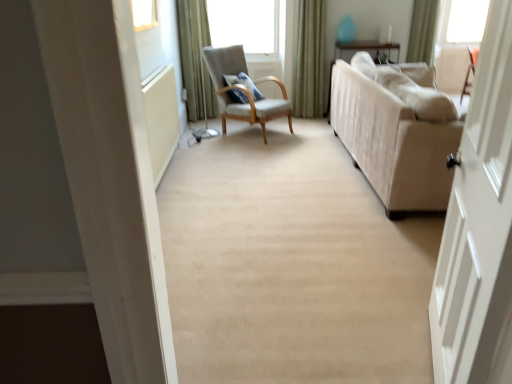
What do you see at coordinates (396, 133) in the screenshot?
I see `beige fabric couch at right` at bounding box center [396, 133].

Describe the element at coordinates (190, 58) in the screenshot. I see `green fabric curtain at upper left, arranged as the third curtain when viewed from the right` at that location.

The height and width of the screenshot is (384, 512). What do you see at coordinates (423, 31) in the screenshot?
I see `green fabric curtain at upper right, the third curtain when ordered from left to right` at bounding box center [423, 31].

Where is `green velvet curtain at upper right, which is the second curtain from left to right`? The image size is (512, 384). green velvet curtain at upper right, which is the second curtain from left to right is located at coordinates (309, 58).

Image resolution: width=512 pixels, height=384 pixels. Find the location of `beige fabric couch at right`. beige fabric couch at right is located at coordinates (396, 133).

Looking at their sizes, would you say green velvet curtain at upper right, which is the second curtain from left to right, is wider or thinner than blue textured pillow at center?

Clearly, green velvet curtain at upper right, which is the second curtain from left to right, has less width compared to blue textured pillow at center.

Are green velvet curtain at upper right, which is the second curtain from left to right, and blue textured pillow at center beside each other?

No, green velvet curtain at upper right, which is the second curtain from left to right, is not making contact with blue textured pillow at center.

Can you tell me how much green velvet curtain at upper right, which is the second curtain from right to left, and blue textured pillow at center differ in facing direction?

51.9 degrees separate the facing orientations of green velvet curtain at upper right, which is the second curtain from right to left, and blue textured pillow at center.

From the image's perspective, is green velvet curtain at upper right, which is the second curtain from left to right, over blue textured pillow at center?

Yes.

Consider the image. Are blue textured pillow at center and beige fabric couch at right located far from each other?

That's right, there is a large distance between blue textured pillow at center and beige fabric couch at right.

Which object is further away from the camera taking this photo, blue textured pillow at center or beige fabric couch at right?

blue textured pillow at center.

From the image's perspective, which one is positioned higher, blue textured pillow at center or beige fabric couch at right?

blue textured pillow at center appears higher in the image.

Is blue textured pillow at center not within beige fabric couch at right?

Yes, blue textured pillow at center is located beyond the bounds of beige fabric couch at right.

Does beige fabric couch at right touch light gray fabric chair at center?

No, beige fabric couch at right is not with light gray fabric chair at center.

Which point is more forward, (430, 153) or (273, 115)?

The point (430, 153) is closer to the camera.

What's the angular difference between beige fabric couch at right and light gray fabric chair at center's facing directions?

42.2 degrees separate the facing orientations of beige fabric couch at right and light gray fabric chair at center.

From a real-world perspective, is beige fabric couch at right physically located above or below light gray fabric chair at center?

From a real-world perspective, beige fabric couch at right is physically below light gray fabric chair at center.

From a real-world perspective, is green fabric curtain at upper right, which is the first curtain in right-to-left order, located higher than beige fabric couch at right?

Indeed, from a real-world perspective, green fabric curtain at upper right, which is the first curtain in right-to-left order, stands above beige fabric couch at right.

Can you tell me how much green fabric curtain at upper right, the third curtain when ordered from left to right, and beige fabric couch at right differ in facing direction?

They differ by 34.3 degrees in their facing directions.

Is green fabric curtain at upper right, the third curtain when ordered from left to right, surrounding beige fabric couch at right?

No, beige fabric couch at right is not surrounded by green fabric curtain at upper right, the third curtain when ordered from left to right.

Locate an element on the screen. Image resolution: width=512 pixels, height=384 pixels. chair lying in front of the green fabric curtain at upper right, which is the first curtain in right-to-left order is located at coordinates (242, 90).

Is the depth of light gray fabric chair at center less than that of green fabric curtain at upper right, the third curtain when ordered from left to right?

Yes, it is.

Based on the photo, can you confirm if light gray fabric chair at center is shorter than green fabric curtain at upper right, the third curtain when ordered from left to right?

In fact, light gray fabric chair at center may be taller than green fabric curtain at upper right, the third curtain when ordered from left to right.

Is light gray fabric chair at center turned away from green fabric curtain at upper right, the third curtain when ordered from left to right?

No, light gray fabric chair at center is not facing the opposite direction of green fabric curtain at upper right, the third curtain when ordered from left to right.

Where is `the 2nd curtain counting from the left side of the beige fabric couch at right`? Image resolution: width=512 pixels, height=384 pixels. the 2nd curtain counting from the left side of the beige fabric couch at right is located at coordinates (190, 58).

Who is bigger, green fabric curtain at upper left, arranged as the third curtain when viewed from the right, or beige fabric couch at right?

beige fabric couch at right.

Looking at this image, from the image's perspective, which one is positioned lower, green fabric curtain at upper left, which is the first curtain from left to right, or beige fabric couch at right?

beige fabric couch at right appears lower in the image.

Which of these two, green fabric curtain at upper left, which is the first curtain from left to right, or beige fabric couch at right, stands taller?

green fabric curtain at upper left, which is the first curtain from left to right, is taller.

Does green fabric curtain at upper left, arranged as the third curtain when viewed from the right, contain green velvet curtain at upper right, which is the second curtain from left to right?

No, green velvet curtain at upper right, which is the second curtain from left to right, is not a part of green fabric curtain at upper left, arranged as the third curtain when viewed from the right.

Is point (207, 116) closer to viewer compared to point (314, 76)?

Yes, it is.

Is green fabric curtain at upper left, which is the first curtain from left to right, to the left of green velvet curtain at upper right, which is the second curtain from right to left, from the viewer's perspective?

Correct, you'll find green fabric curtain at upper left, which is the first curtain from left to right, to the left of green velvet curtain at upper right, which is the second curtain from right to left.

Locate an element on the screen. The width and height of the screenshot is (512, 384). the 2nd curtain behind the blue textured pillow at center, starting your count from the anchor is located at coordinates (309, 58).

Locate an element on the screen. Image resolution: width=512 pixels, height=384 pixels. studio couch directly beneath the blue textured pillow at center (from a real-world perspective) is located at coordinates (396, 133).

In the scene shown: Looking at the image, which one is located further to blue textured pillow at center, white wooden door at right or green fabric curtain at upper left, arranged as the third curtain when viewed from the right?

Among the two, white wooden door at right is located further to blue textured pillow at center.

Looking at the image, which one is located further to white wooden door at right, beige fabric couch at right or light gray fabric chair at center?

light gray fabric chair at center is further to white wooden door at right.

From the image, which object appears to be farther from green velvet curtain at upper right, which is the second curtain from right to left, light gray fabric chair at center or white wooden door at right?

Among the two, white wooden door at right is located further to green velvet curtain at upper right, which is the second curtain from right to left.

Based on their spatial positions, is blue textured pillow at center or green fabric curtain at upper left, arranged as the third curtain when viewed from the right, closer to white wooden door at right?

blue textured pillow at center.

Based on the photo, estimate the real-world distances between objects in this image. Which object is closer to green velvet curtain at upper right, which is the second curtain from left to right, beige fabric couch at right or green fabric curtain at upper right, the third curtain when ordered from left to right?

The object closer to green velvet curtain at upper right, which is the second curtain from left to right, is green fabric curtain at upper right, the third curtain when ordered from left to right.

When comparing their distances from green velvet curtain at upper right, which is the second curtain from left to right, does light gray fabric chair at center or beige fabric couch at right seem closer?

The object closer to green velvet curtain at upper right, which is the second curtain from left to right, is light gray fabric chair at center.

From the image, which object appears to be farther from green fabric curtain at upper left, which is the first curtain from left to right, light gray fabric chair at center or green fabric curtain at upper right, the third curtain when ordered from left to right?

Based on the image, green fabric curtain at upper right, the third curtain when ordered from left to right, appears to be further to green fabric curtain at upper left, which is the first curtain from left to right.

Looking at this image, considering their positions, is light gray fabric chair at center positioned further to beige fabric couch at right than blue textured pillow at center?

blue textured pillow at center lies further to beige fabric couch at right than the other object.

At what (x,y) coordinates should I click in order to perform the action: click on chair between white wooden door at right and green fabric curtain at upper right, the third curtain when ordered from left to right, in the front-back direction. Please return your answer as a coordinate pair (x, y). The width and height of the screenshot is (512, 384). Looking at the image, I should click on (x=242, y=90).

I want to click on pillow between beige fabric couch at right and green fabric curtain at upper right, the third curtain when ordered from left to right, in the front-back direction, so click(244, 84).

Find the location of a particular element. The height and width of the screenshot is (384, 512). pillow between white wooden door at right and green fabric curtain at upper right, the third curtain when ordered from left to right, in the front-back direction is located at coordinates (244, 84).

Find the location of a particular element. The width and height of the screenshot is (512, 384). curtain located between light gray fabric chair at center and green fabric curtain at upper right, the third curtain when ordered from left to right, in the left-right direction is located at coordinates (309, 58).